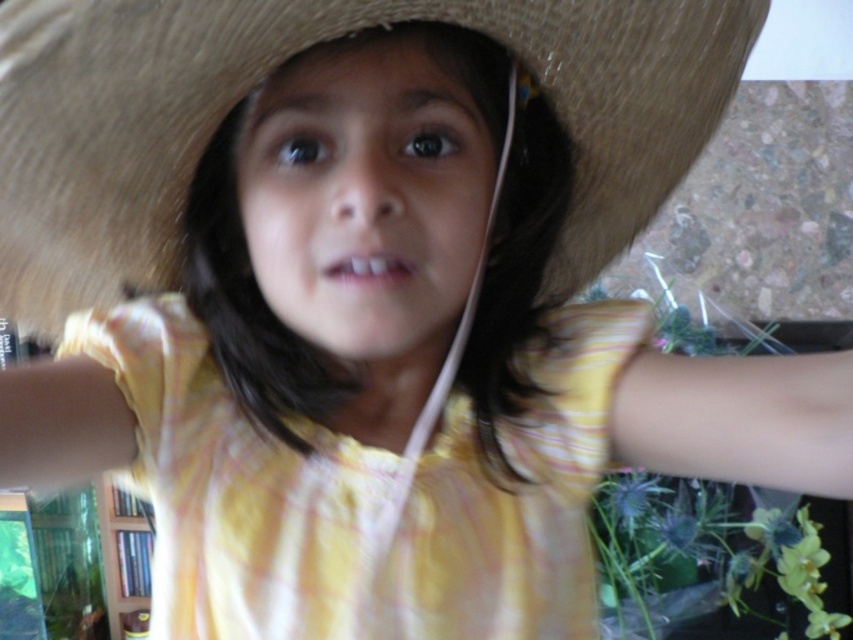
Question: Does brown straw hat at center appear over yellow cotton dress at center?

Choices:
 (A) no
 (B) yes

Answer: (B)

Question: Which point is farther to the camera?

Choices:
 (A) brown straw hat at center
 (B) yellow cotton dress at center

Answer: (B)

Question: Among these objects, which one is farthest from the camera?

Choices:
 (A) yellow cotton dress at center
 (B) brown straw hat at center

Answer: (A)

Question: Does brown straw hat at center appear over yellow cotton dress at center?

Choices:
 (A) yes
 (B) no

Answer: (A)

Question: In this image, where is brown straw hat at center located relative to yellow cotton dress at center?

Choices:
 (A) left
 (B) right

Answer: (B)